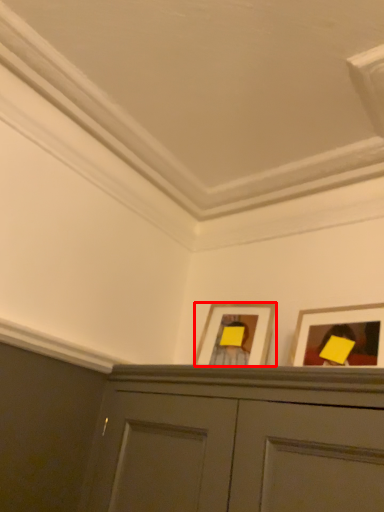
Question: From the image's perspective, where is picture frame (annotated by the red box) located relative to picture frame?

Choices:
 (A) below
 (B) above

Answer: (A)